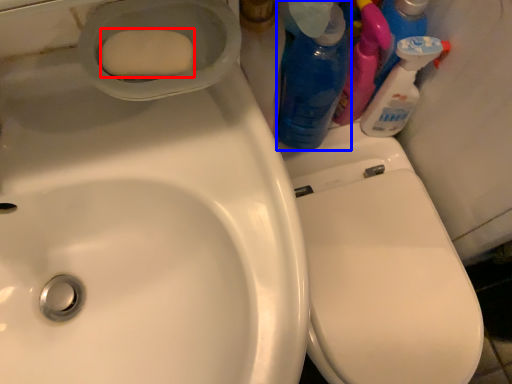
Question: Which point is closer to the camera, soap (highlighted by a red box) or cleaning product (highlighted by a blue box)?

Choices:
 (A) soap
 (B) cleaning product

Answer: (A)